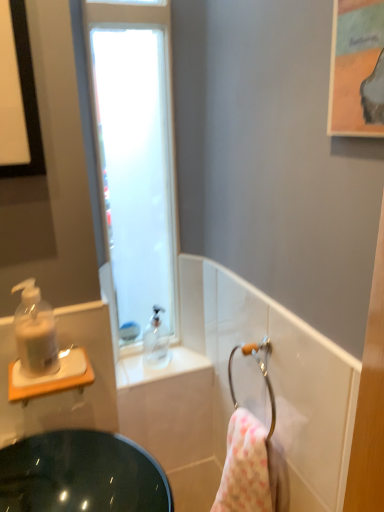
Identify the location of vacant area to the right of transparent plastic soap dispenser at upper center, which ranks as the first soap dispenser in back-to-front order. (192, 361).